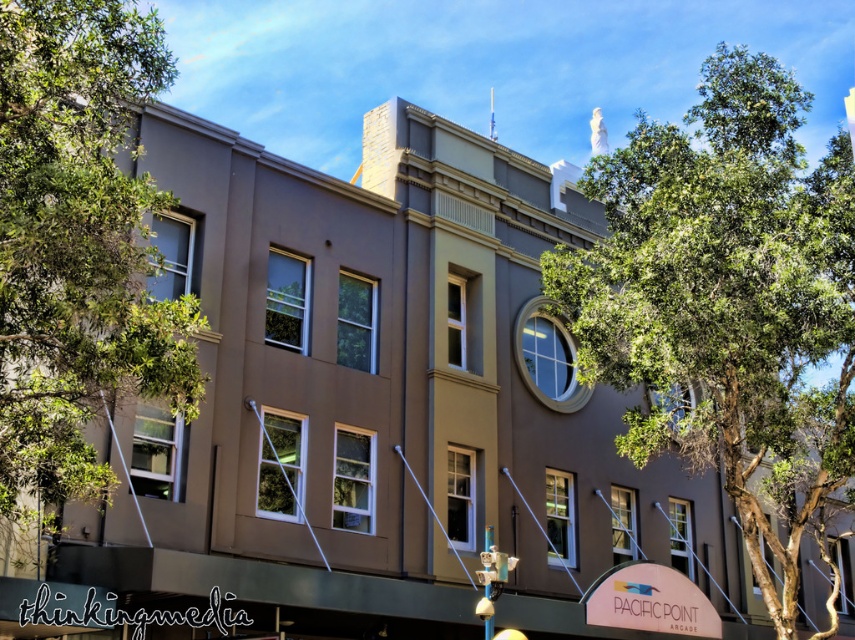
Question: Which of the following is the closest to the observer?

Choices:
 (A) (139, 211)
 (B) (664, 282)

Answer: (A)

Question: Does green leafy tree at upper right lie behind green leafy tree at left?

Choices:
 (A) yes
 (B) no

Answer: (A)

Question: Is green leafy tree at upper right to the right of green leafy tree at left from the viewer's perspective?

Choices:
 (A) yes
 (B) no

Answer: (A)

Question: Is green leafy tree at upper right wider than green leafy tree at left?

Choices:
 (A) no
 (B) yes

Answer: (B)